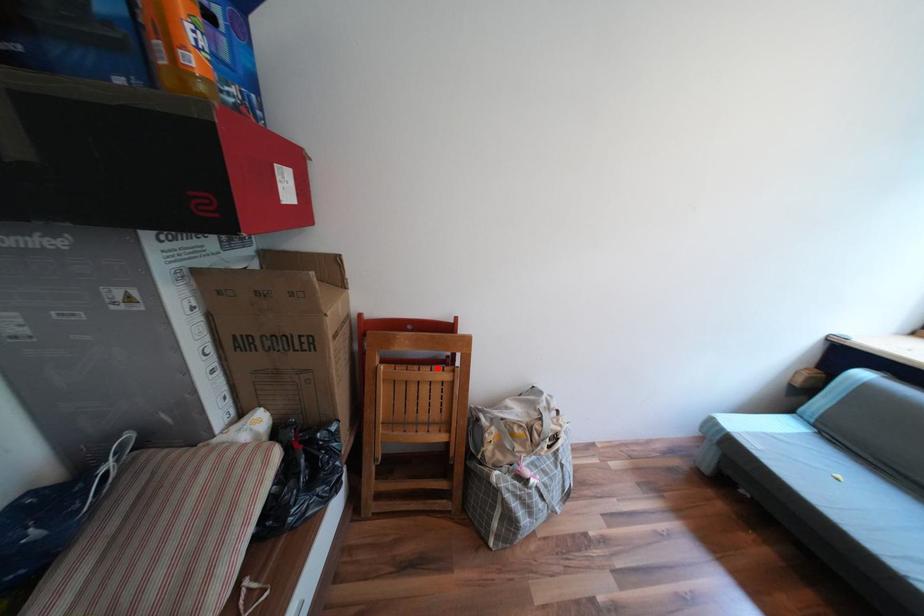
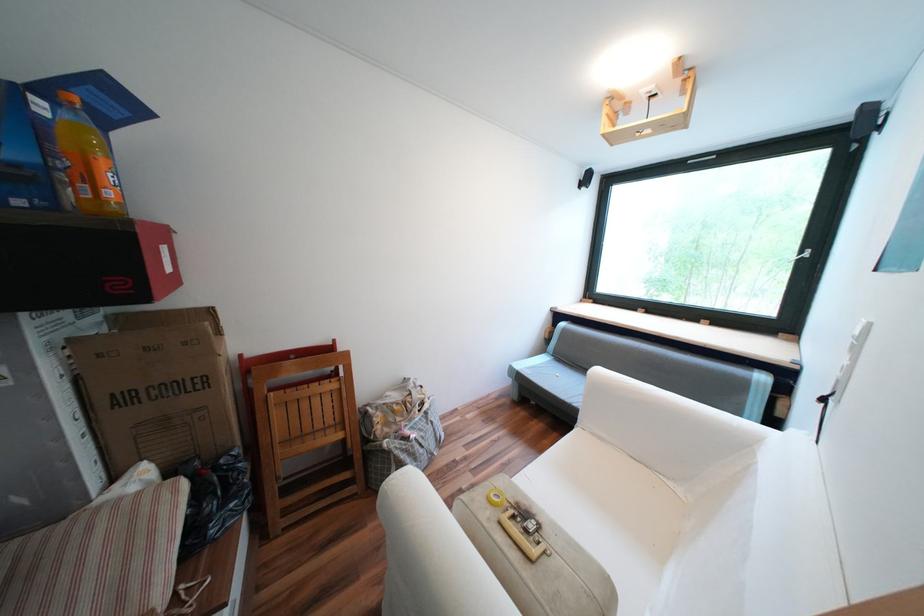
Find the pixel in the second image that matches the highlighted location in the first image.

(325, 383)